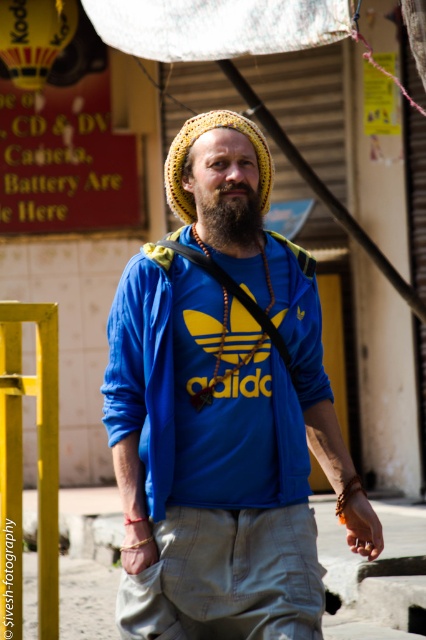
Question: Which point is closer to the camera?

Choices:
 (A) yellow knitted hat at center
 (B) blue cotton t-shirt at center
 (C) beardsoft/fuzzyat center

Answer: (B)

Question: Which of the following is the farthest from the observer?

Choices:
 (A) brown sand at lower center
 (B) blue cotton t-shirt at center
 (C) blue cotton shirt at center
 (D) beardsoft/fuzzyat center

Answer: (A)

Question: Does blue cotton t-shirt at center come behind beardsoft/fuzzyat center?

Choices:
 (A) no
 (B) yes

Answer: (A)

Question: Does beardsoft/fuzzyat center appear over yellow knitted hat at center?

Choices:
 (A) yes
 (B) no

Answer: (B)

Question: Based on their relative distances, which object is farther from the yellow knitted hat at center?

Choices:
 (A) beardsoft/fuzzyat center
 (B) blue cotton t-shirt at center

Answer: (B)

Question: Is blue cotton shirt at center to the left of brown sand at lower center from the viewer's perspective?

Choices:
 (A) yes
 (B) no

Answer: (B)